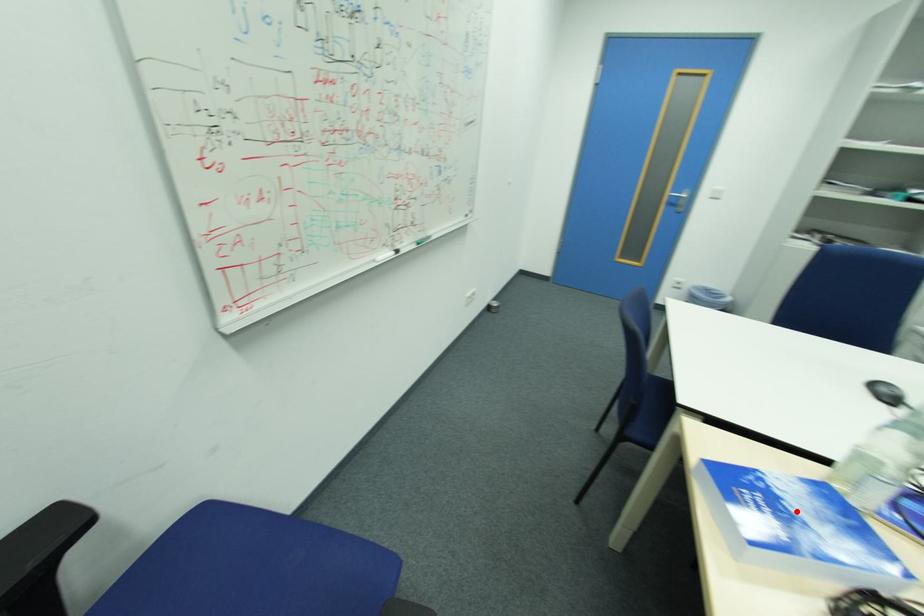
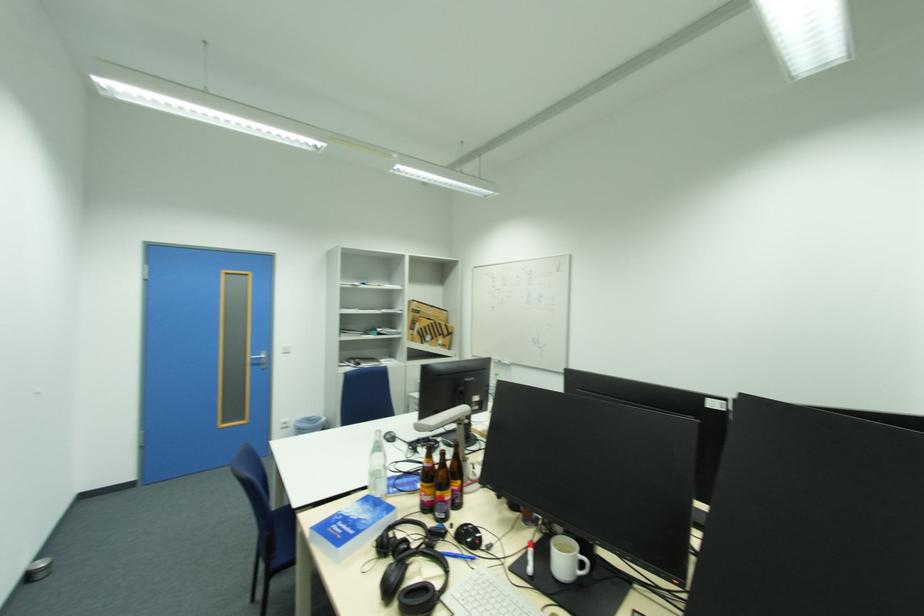
Find the pixel in the second image that matches the highlighted location in the first image.

(360, 517)